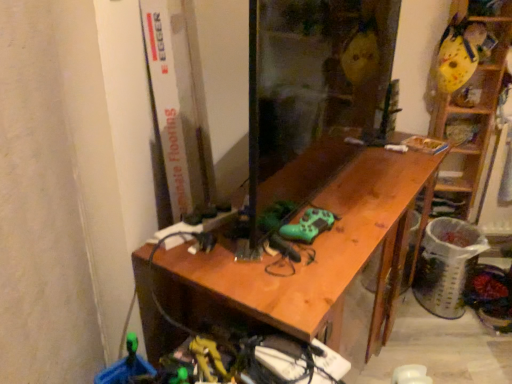
Describe the element at coordinates (470, 107) in the screenshot. I see `wooden at right` at that location.

At what (x,y) coordinates should I click in order to perform the action: click on wooden at right. Please return your answer as a coordinate pair (x, y). Looking at the image, I should click on (470, 107).

Identify the location of wooden desk at center. The height and width of the screenshot is (384, 512). (312, 245).

The image size is (512, 384). Describe the element at coordinates (312, 245) in the screenshot. I see `wooden desk at center` at that location.

Find the location of `wooden at right`. wooden at right is located at coordinates (470, 107).

Is wooden desk at center to the right of wooden at right from the viewer's perspective?

No.

Considering the relative positions of wooden desk at center and wooden at right in the image provided, is wooden desk at center in front of wooden at right?

Yes, wooden desk at center is in front of wooden at right.

Is point (384, 255) positioned behind point (440, 176)?

No, (384, 255) is closer to viewer.

From the image's perspective, between wooden desk at center and wooden at right, who is located below?

From the image's view, wooden desk at center is below.

From a real-world perspective, relative to wooden at right, is wooden desk at center vertically above or below?

wooden desk at center is below wooden at right.

Does wooden desk at center have a greater width compared to wooden at right?

Yes.

Considering the sizes of objects wooden desk at center and wooden at right in the image provided, who is taller, wooden desk at center or wooden at right?

wooden at right is taller.

Looking at this image, does wooden desk at center have a smaller size compared to wooden at right?

No, wooden desk at center is not smaller than wooden at right.

Is wooden desk at center surrounding wooden at right?

No.

Would you say wooden desk at center is a long distance from wooden at right?

No, wooden desk at center is not far from wooden at right.

Could you tell me if wooden desk at center is facing wooden at right?

No, wooden desk at center does not turn towards wooden at right.

What are the coordinates of `desk located below the wooden at right (from the image's perspective)` in the screenshot? It's located at (312, 245).

Which object is positioned more to the left, wooden at right or wooden desk at center?

Positioned to the left is wooden desk at center.

Is wooden at right further to the viewer compared to wooden desk at center?

Yes, wooden at right is behind wooden desk at center.

Which point is more forward, (474, 140) or (246, 303)?

Positioned in front is point (246, 303).

From the image's perspective, is wooden at right above wooden desk at center?

Correct, wooden at right appears higher than wooden desk at center in the image.

From a real-world perspective, which is physically above, wooden at right or wooden desk at center?

wooden at right, from a real-world perspective.

Can you confirm if wooden at right is thinner than wooden desk at center?

Indeed, wooden at right has a lesser width compared to wooden desk at center.

In terms of height, does wooden at right look taller or shorter compared to wooden desk at center?

wooden at right is taller than wooden desk at center.

Between wooden at right and wooden desk at center, which one has larger size?

wooden desk at center is bigger.

Would you say wooden at right is outside wooden desk at center?

wooden at right is positioned outside wooden desk at center.

Is wooden at right far away from wooden desk at center?

Actually, wooden at right and wooden desk at center are a little close together.

Is wooden at right oriented away from wooden desk at center?

wooden at right does not have its back to wooden desk at center.

What's the angular difference between wooden at right and wooden desk at center's facing directions?

They differ by 58.3 degrees in their facing directions.

In order to click on shelf that is above the wooden desk at center (from a real-world perspective) in this screenshot , I will do `click(470, 107)`.

You are a GUI agent. You are given a task and a screenshot of the screen. Output one action in this format:
    pyautogui.click(x=<x>, y=<y>)
    Task: Click on the shelf above the wooden desk at center (from the image's perspective)
    
    Given the screenshot: What is the action you would take?
    pyautogui.click(x=470, y=107)

What are the coordinates of `shelf above the wooden desk at center (from a real-world perspective)` in the screenshot? It's located at (470, 107).